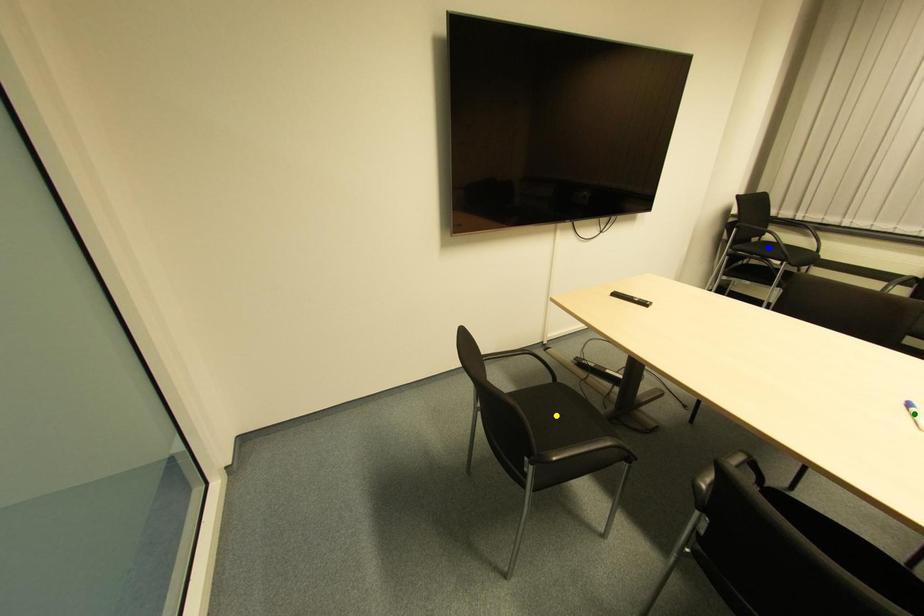
Order these from nearest to farthest:
blue point
yellow point
green point

blue point → yellow point → green point